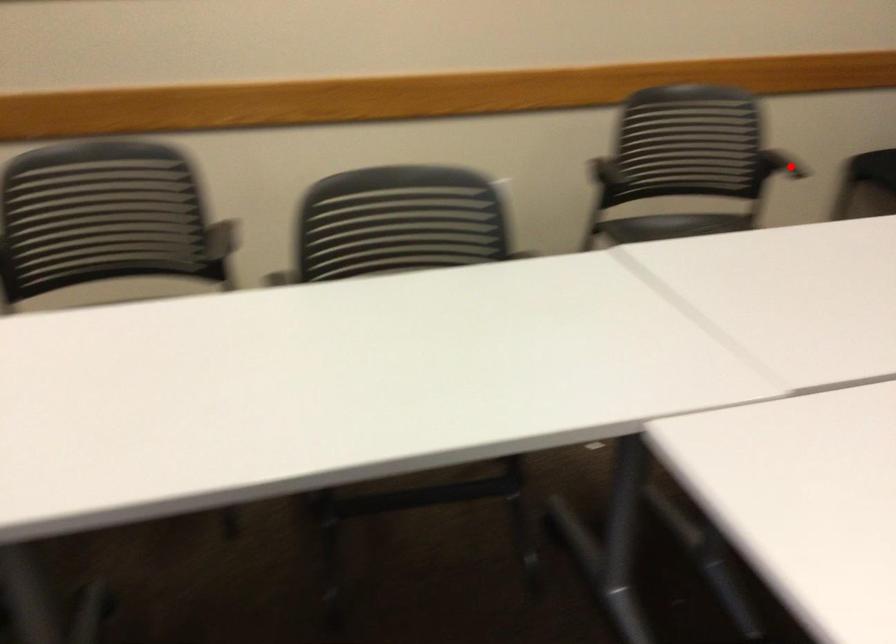
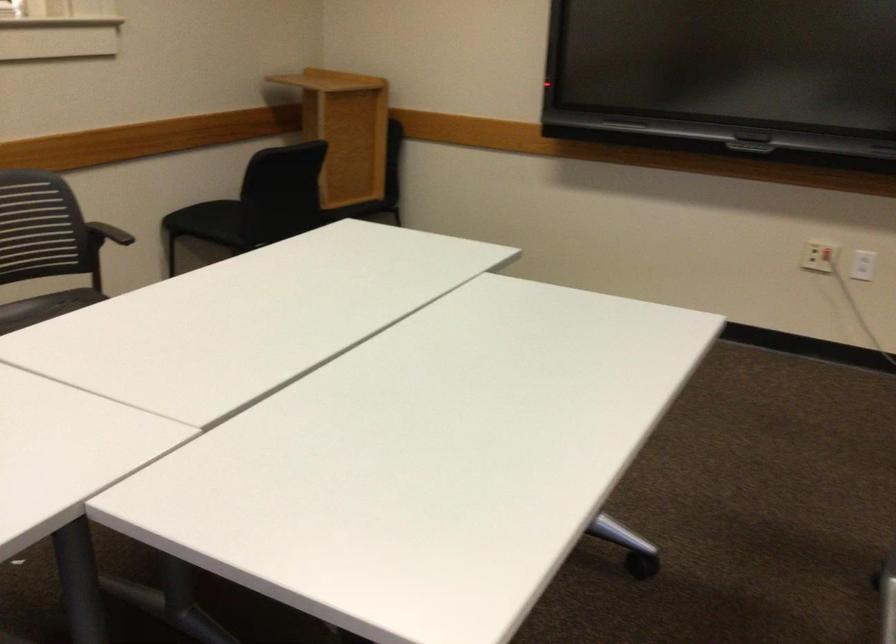
Question: I am providing you with two images of the same scene from different viewpoints. A red point is marked on the first image. Can you still see the location of the red point in image 2?

Choices:
 (A) Yes
 (B) No

Answer: (B)